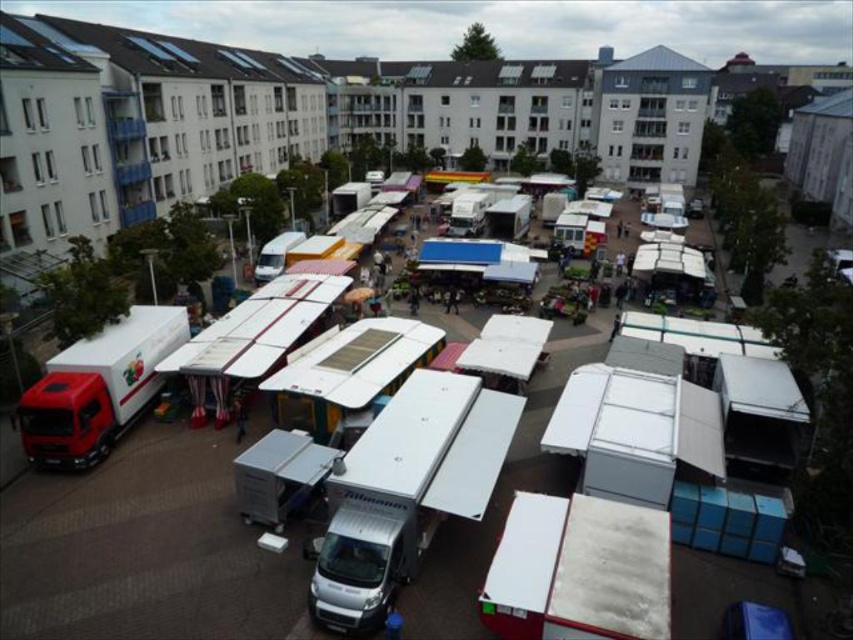
You are standing at the elevated viewpoint overlooking the outdoor market. You notice two points marked in the scene. From your vantage point, which of the two points, point (59, 435) or point (256, 268), is closer to you?

Point (59, 435) is closer to the viewer than point (256, 268).

You are standing at the edge of the market and want to take a photo of both the red matte truck at left and the white matte van at center. Which one should you adjust your camera focus on first to ensure both are in the frame?

Since the red matte truck at left is closer to the viewer than the white matte van at center, you should focus on the red matte truck at left first to ensure both are in focus as you adjust the camera.